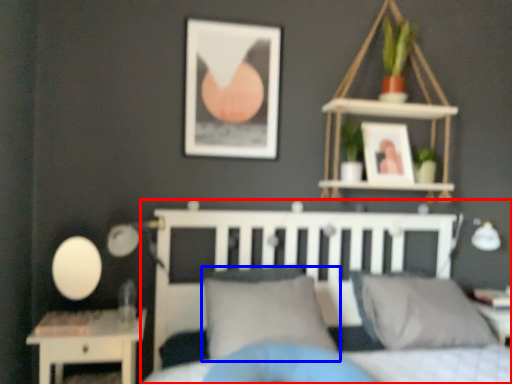
Question: Which object appears closest to the camera in this image, bed (highlighted by a red box) or pillow (highlighted by a blue box)?

Choices:
 (A) bed
 (B) pillow

Answer: (A)